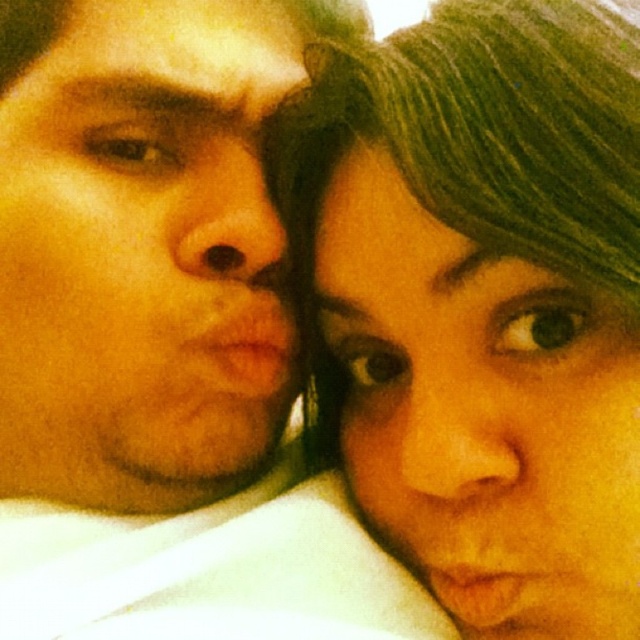
Does matte skin face at left have a larger size compared to green matte hair at upper right?

No.

Does matte skin face at left appear on the right side of green matte hair at upper right?

In fact, matte skin face at left is to the left of green matte hair at upper right.

Which is in front, point (6, 317) or point (374, 426)?

Positioned in front is point (6, 317).

The width and height of the screenshot is (640, 640). What are the coordinates of `matte skin face at left` in the screenshot? It's located at 141,248.